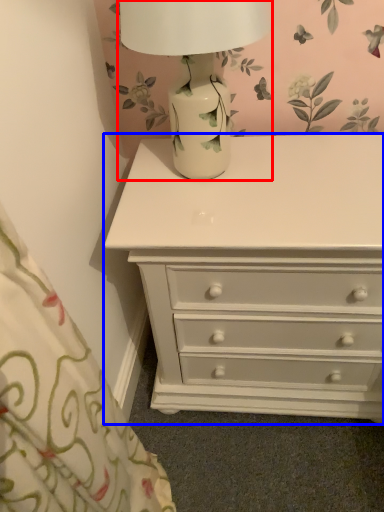
Question: Which of the following is the closest to the observer, table lamp (highlighted by a red box) or chest of drawers (highlighted by a blue box)?

Choices:
 (A) table lamp
 (B) chest of drawers

Answer: (A)